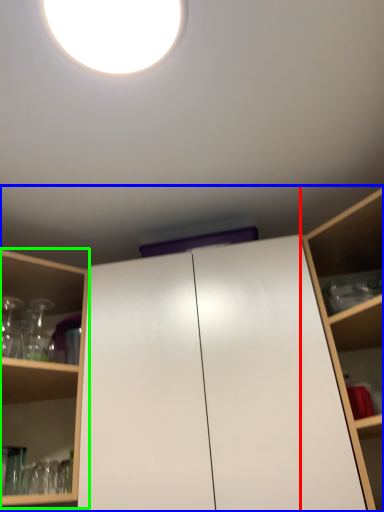
Question: Considering the real-world distances, which object is farthest from shelf (highlighted by a red box)? cabinetry (highlighted by a blue box) or shelf (highlighted by a green box)?

Choices:
 (A) cabinetry
 (B) shelf

Answer: (B)